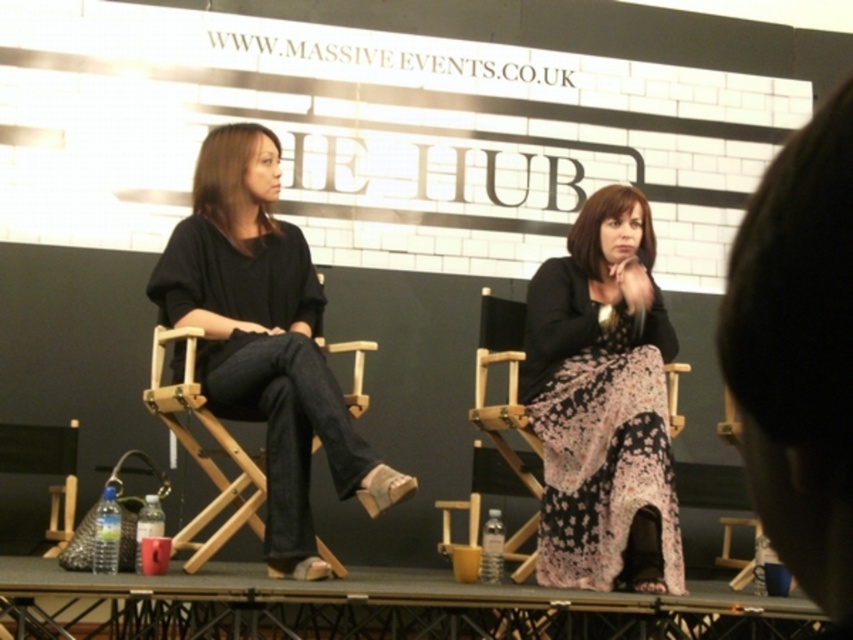
Question: Is floral-patterned dress at center below wooden director's chair at center?

Choices:
 (A) no
 (B) yes

Answer: (A)

Question: Among these objects, which one is nearest to the camera?

Choices:
 (A) wooden director's chair at center
 (B) wooden director's chair at lower left

Answer: (A)

Question: Which point is closer to the camera?

Choices:
 (A) wooden director's chair at lower left
 (B) wooden director's chair at center

Answer: (B)

Question: Is floral-patterned dress at center bigger than wooden director's chair at lower left?

Choices:
 (A) no
 (B) yes

Answer: (B)

Question: Does floral-patterned dress at center appear under wooden director's chair at center?

Choices:
 (A) no
 (B) yes

Answer: (A)

Question: Which point appears closest to the camera in this image?

Choices:
 (A) (6, 456)
 (B) (223, 449)
 (C) (578, 529)

Answer: (C)